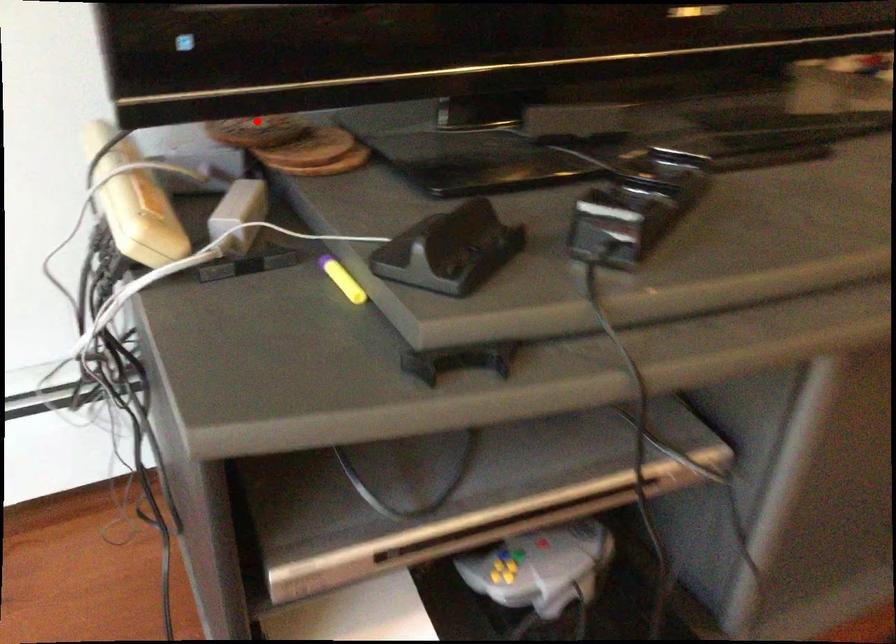
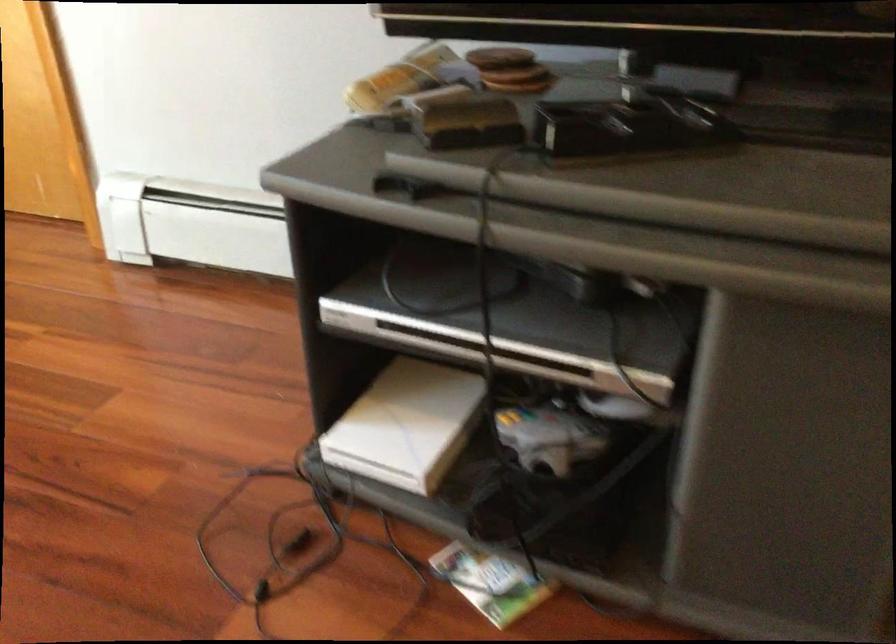
Where in the second image is the point corresponding to the highlighted location from the first image?

(500, 58)